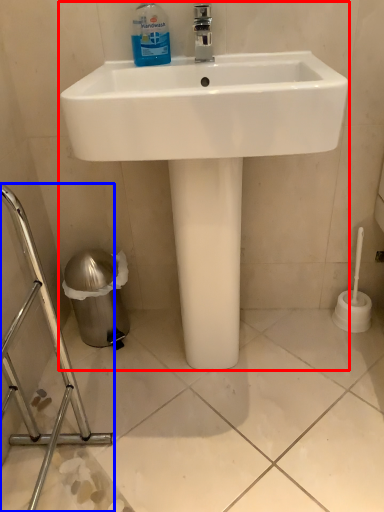
Question: Which object is closer to the camera taking this photo, sink (highlighted by a red box) or porcelain (highlighted by a blue box)?

Choices:
 (A) sink
 (B) porcelain

Answer: (B)